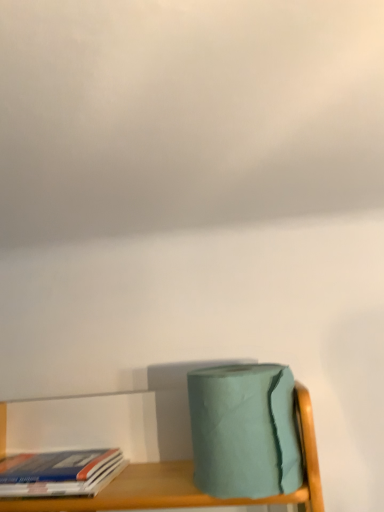
Question: From the image's perspective, is hardcover book at lower left positioned above or below cloudy white sky at upper center?

Choices:
 (A) below
 (B) above

Answer: (A)

Question: From a real-world perspective, is hardcover book at lower left physically located above or below cloudy white sky at upper center?

Choices:
 (A) above
 (B) below

Answer: (B)

Question: Based on their relative distances, which object is farther from the hardcover book at lower left?

Choices:
 (A) teal matte toilet paper at lower right
 (B) cloudy white sky at upper center

Answer: (B)

Question: Which is farther from the cloudy white sky at upper center?

Choices:
 (A) hardcover book at lower left
 (B) teal matte toilet paper at lower right

Answer: (A)